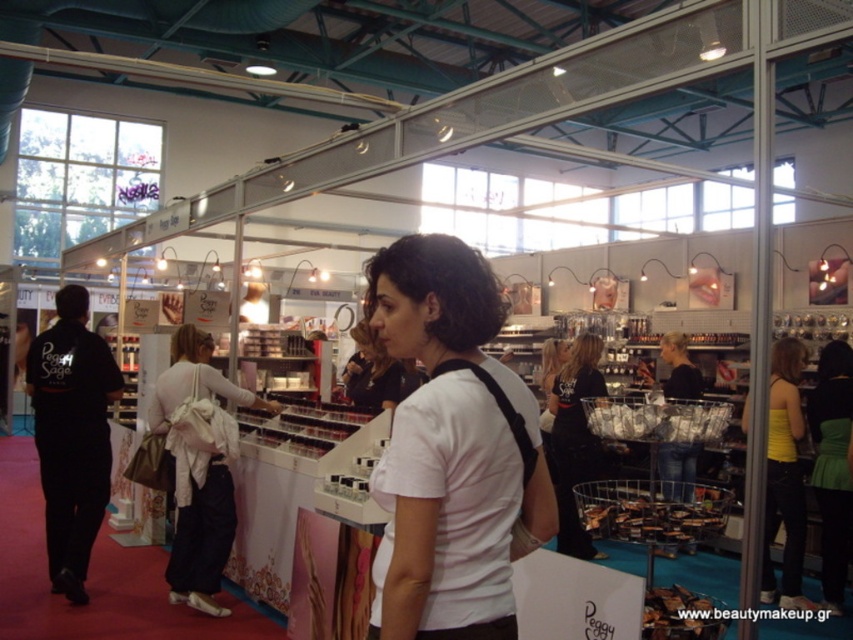
Where is `black fabric jacket at left`? The height and width of the screenshot is (640, 853). black fabric jacket at left is located at coordinates (71, 435).

Between black fabric jacket at left and black fabric pants at center, which one is positioned higher?

Positioned higher is black fabric jacket at left.

I want to click on black fabric jacket at left, so click(x=71, y=435).

Is black fabric jacket at left wider than white fabric bag at center?

Incorrect, black fabric jacket at left's width does not surpass white fabric bag at center's.

Is point (80, 400) positioned in front of point (213, 374)?

That is True.

You are a GUI agent. You are given a task and a screenshot of the screen. Output one action in this format:
    pyautogui.click(x=<x>, y=<y>)
    Task: Click on the black fabric jacket at left
    
    Given the screenshot: What is the action you would take?
    pyautogui.click(x=71, y=435)

Which of these two, white matte shirt at center or black fabric pants at center, stands taller?

Standing taller between the two is black fabric pants at center.

Does point (474, 353) lie behind point (555, 424)?

No, it is not.

Identify the location of white matte shirt at center. (451, 451).